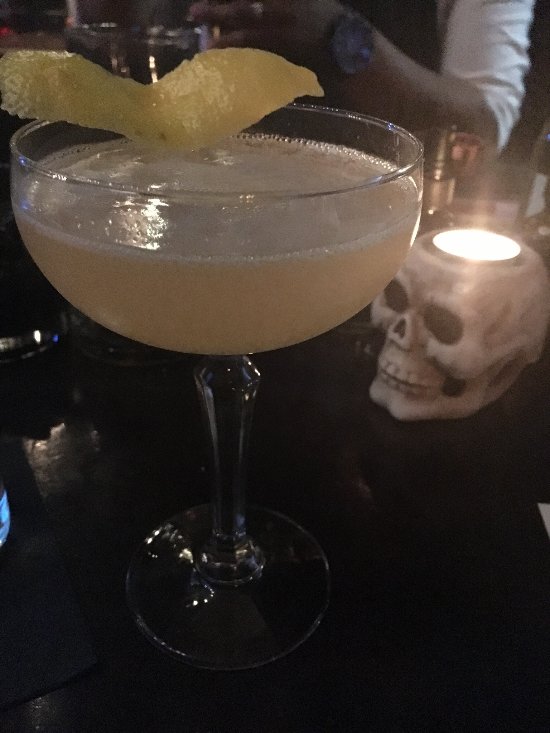
In order to click on mixed drink glass in this screenshot , I will do `click(319, 132)`.